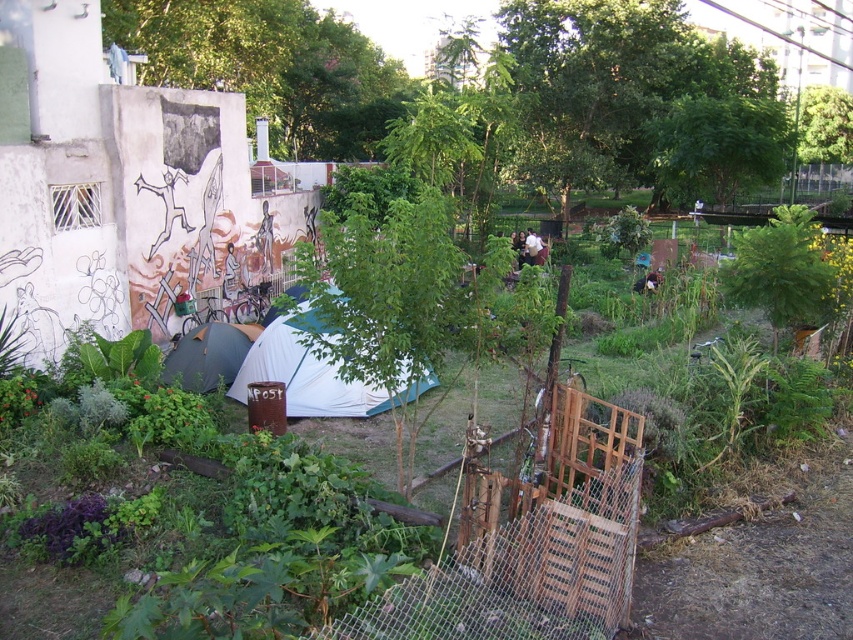
Is white fabric tent at center positioned before dark blue tarp at center?

Yes, white fabric tent at center is closer to the viewer.

Which is below, white fabric tent at center or dark blue tarp at center?

Positioned lower is white fabric tent at center.

Is point (305, 349) positioned in front of point (251, 330)?

Yes, it is in front of point (251, 330).

This screenshot has width=853, height=640. Find the location of `white fabric tent at center`. white fabric tent at center is located at coordinates (312, 371).

Who is positioned more to the right, dark blue tarp at center or white fabric at center?

Positioned to the right is white fabric at center.

Is dark blue tarp at center bigger than white fabric at center?

No, dark blue tarp at center is not bigger than white fabric at center.

You are a GUI agent. You are given a task and a screenshot of the screen. Output one action in this format:
    pyautogui.click(x=<x>, y=<y>)
    Task: Click on the dark blue tarp at center
    The height and width of the screenshot is (640, 853).
    Given the screenshot: What is the action you would take?
    pyautogui.click(x=207, y=355)

Can you confirm if white fabric tent at center is positioned to the left of white fabric at center?

Yes, white fabric tent at center is to the left of white fabric at center.

Between point (312, 394) and point (524, 248), which one is positioned in front?

Point (312, 394)

Where is `white fabric tent at center`? white fabric tent at center is located at coordinates (312, 371).

The width and height of the screenshot is (853, 640). Identify the location of white fabric tent at center. (312, 371).